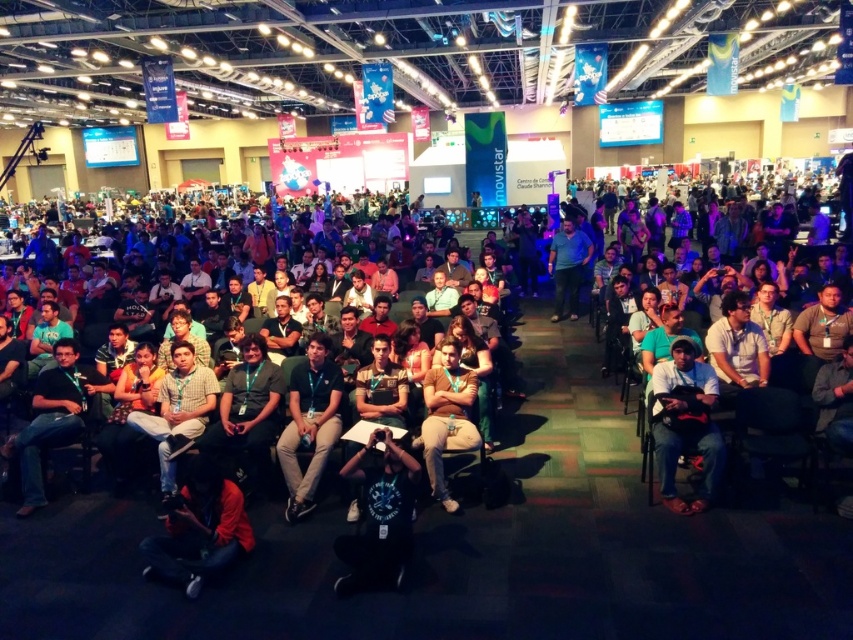
Question: Can you confirm if dark blue jeans at center is smaller than green fabric shirt at center?

Choices:
 (A) no
 (B) yes

Answer: (B)

Question: Based on their relative distances, which object is nearer to the green fabric shirt at center?

Choices:
 (A) blue cotton shirt at center
 (B) brown cotton shirt at center

Answer: (B)

Question: Is brown cotton shirt at center smaller than blue cotton shirt at center?

Choices:
 (A) yes
 (B) no

Answer: (A)

Question: Which of the following is the farthest from the observer?

Choices:
 (A) (554, 262)
 (B) (299, 492)

Answer: (A)

Question: Among these points, which one is farthest from the camera?

Choices:
 (A) (555, 243)
 (B) (440, 412)

Answer: (A)

Question: From the image, what is the correct spatial relationship of dark blue jeans at center in relation to blue cotton shirt at center?

Choices:
 (A) below
 (B) above

Answer: (A)